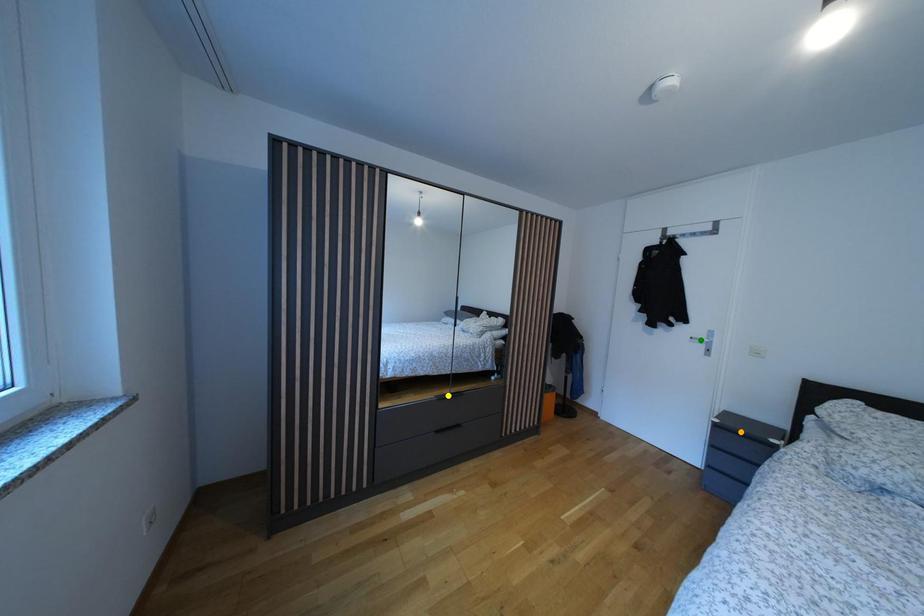
Order these from nearest to farthest:
yellow point, green point, orange point

yellow point
green point
orange point